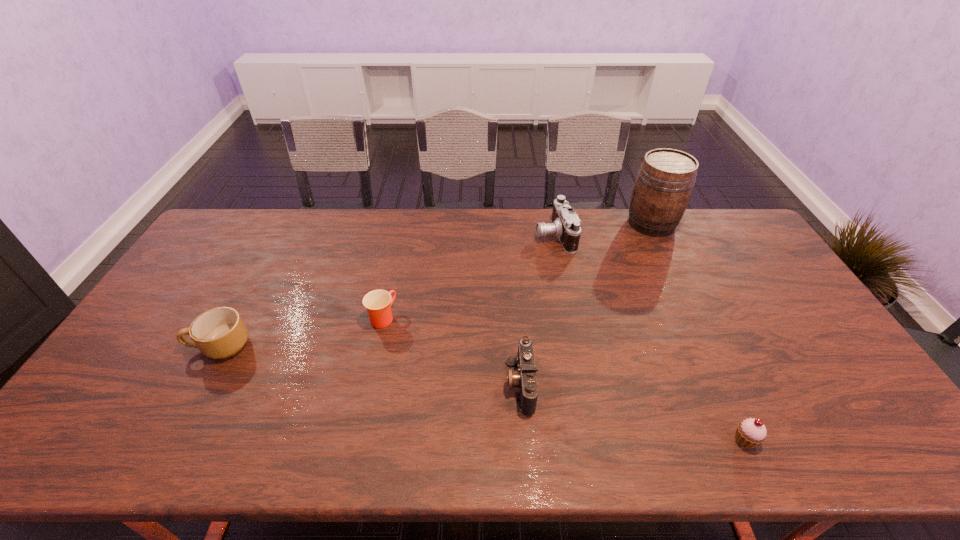
The image size is (960, 540). I want to click on free space between the nearest object and the mug, so click(483, 393).

The width and height of the screenshot is (960, 540). What are the coordinates of `free space between the taller camera and the leftmost object` in the screenshot? It's located at (387, 291).

Find the location of a particular element. This screenshot has width=960, height=540. vacant region between the cupcake and the mug is located at coordinates (483, 393).

Image resolution: width=960 pixels, height=540 pixels. Identify the location of unoccupied position between the tallest object and the leftmost object. (436, 285).

This screenshot has width=960, height=540. Identify the location of free spot between the leftmost object and the nearer camera. (371, 364).

I want to click on free space between the cider and the leftmost object, so click(436, 285).

Locate an element on the screen. unoccupied area between the nearest object and the leftmost object is located at coordinates (483, 393).

At what (x,y) coordinates should I click in order to perform the action: click on free space between the second object from left to right and the leftmost object. Please return your answer as a coordinate pair (x, y). The width and height of the screenshot is (960, 540). Looking at the image, I should click on (301, 332).

Find the location of a particular element. The image size is (960, 540). vacant space that's between the mug and the nearest object is located at coordinates (483, 393).

Locate which object is the closest to the cupcake. Please provide its 2D coordinates. Your answer should be formatted as a tuple, i.e. [(x, y)], where the tuple contains the x and y coordinates of a point satisfying the conditions above.

[(525, 379)]